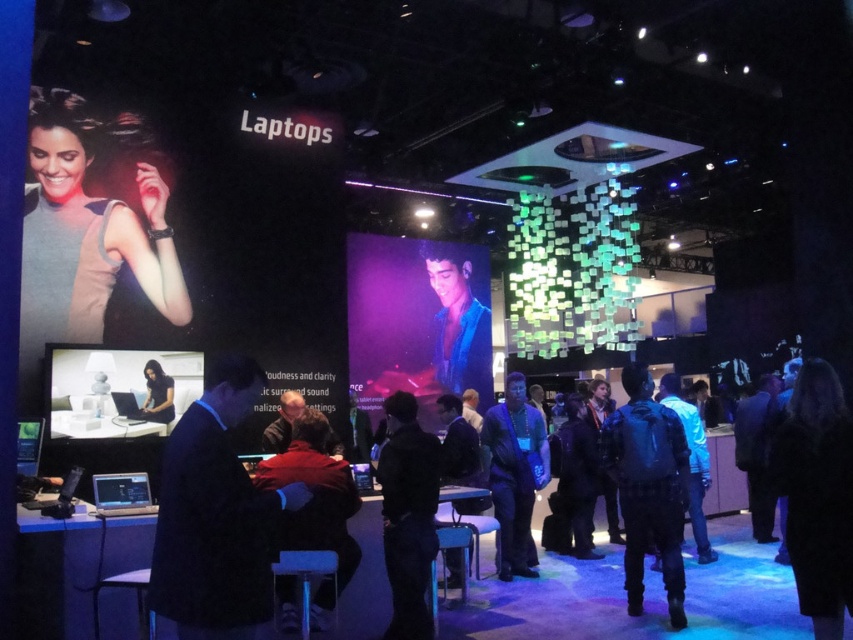
Question: Where is gray matte tank top at upper left located in relation to black matte jacket at center in the image?

Choices:
 (A) right
 (B) left

Answer: (B)

Question: Among these objects, which one is nearest to the camera?

Choices:
 (A) gray matte tank top at upper left
 (B) black matte jacket at center

Answer: (B)

Question: Is black fabric dress at lower right above dark blue backpack at center?

Choices:
 (A) no
 (B) yes

Answer: (B)

Question: Which point is farther to the camera?

Choices:
 (A) (160, 392)
 (B) (195, 561)

Answer: (A)

Question: Which point appears closest to the camera in this image?

Choices:
 (A) (341, 483)
 (B) (625, 387)
 (C) (57, 188)
 (D) (535, 456)

Answer: (A)

Question: Is dark red jacket at center behind blue denim jacket at center?

Choices:
 (A) yes
 (B) no

Answer: (B)